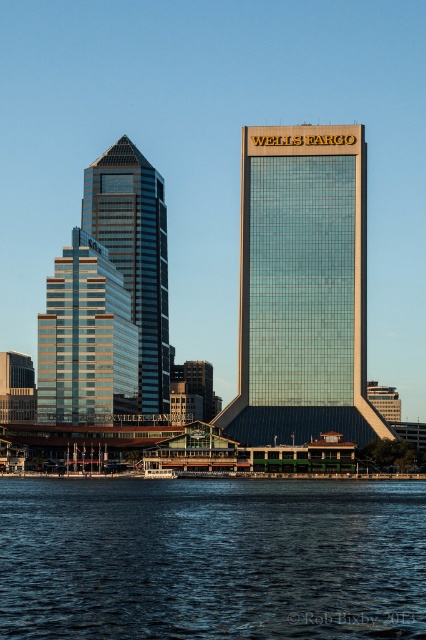
Question: Is shiny glass skyscraper at center behind shiny glass skyscraper at left?

Choices:
 (A) yes
 (B) no

Answer: (B)

Question: Which object is positioned closest to the dark blue water at lower center?

Choices:
 (A) shiny glass skyscraper at left
 (B) matte glass skyscraper at center

Answer: (A)

Question: Can you confirm if dark blue water at lower center is smaller than matte glass skyscraper at center?

Choices:
 (A) yes
 (B) no

Answer: (A)

Question: Which object is the farthest from the shiny glass skyscraper at left?

Choices:
 (A) dark blue water at lower center
 (B) matte glass skyscraper at center
 (C) shiny glass skyscraper at center

Answer: (A)

Question: Does dark blue water at lower center come behind shiny glass skyscraper at left?

Choices:
 (A) no
 (B) yes

Answer: (A)

Question: Which point is farther to the camera?

Choices:
 (A) (63, 349)
 (B) (150, 269)
 (C) (253, 429)
 (D) (357, 576)

Answer: (B)